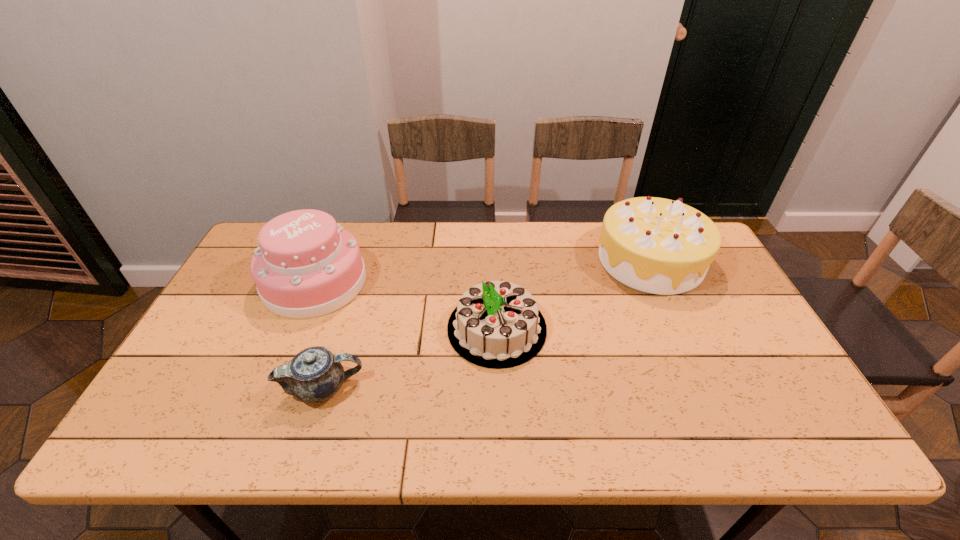
Where is `the leftmost birthday cake`? The width and height of the screenshot is (960, 540). the leftmost birthday cake is located at coordinates (307, 265).

Where is `the rightmost object`? This screenshot has width=960, height=540. the rightmost object is located at coordinates (655, 245).

Where is `the second birthday cake from left to right`? The image size is (960, 540). the second birthday cake from left to right is located at coordinates (497, 324).

Image resolution: width=960 pixels, height=540 pixels. I want to click on the shortest object, so click(314, 375).

Locate an element on the screen. The image size is (960, 540). vacant space located 0.260m on the right of the leftmost birthday cake is located at coordinates (451, 282).

Where is `free space located on the left of the rightmost object`? free space located on the left of the rightmost object is located at coordinates (582, 260).

At what (x,y) coordinates should I click in order to perform the action: click on vacant area located 0.230m on the left of the second birthday cake from right to left. Please return your answer as a coordinate pair (x, y). The height and width of the screenshot is (540, 960). Looking at the image, I should click on (363, 328).

What are the coordinates of `blank space located from the spout of the shortest object` in the screenshot? It's located at (504, 388).

Identify the location of object that is positioned at the left edge. The image size is (960, 540). (307, 265).

Find the location of a particular element. object situated at the right edge is located at coordinates (655, 245).